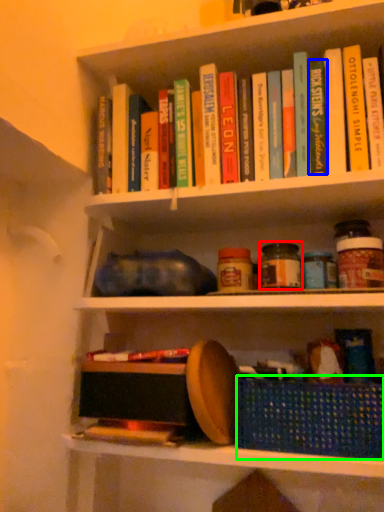
Question: Based on their relative distances, which object is nearer to glass jar (highlighted by a red box)? Choose from paperback book (highlighted by a blue box) and basket (highlighted by a green box).

Choices:
 (A) paperback book
 (B) basket

Answer: (A)